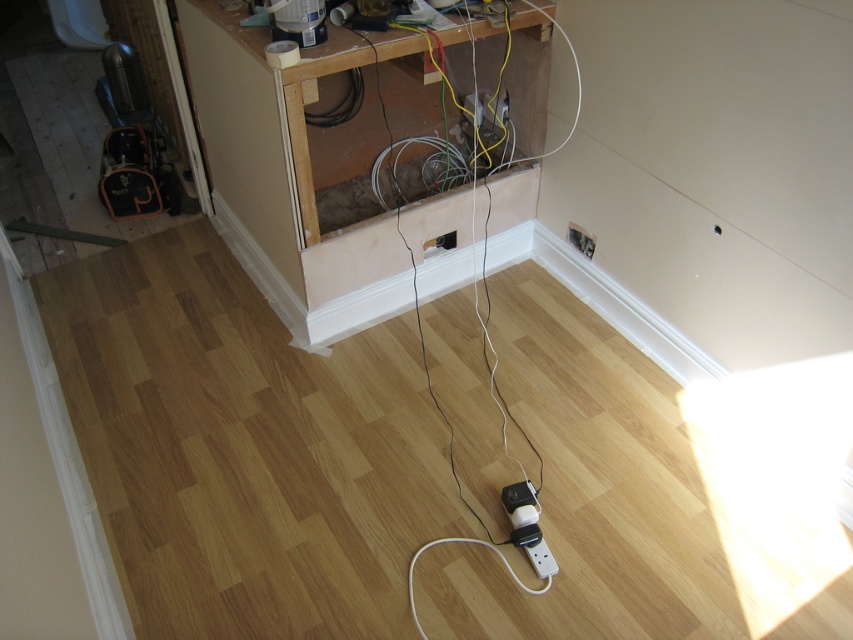
Is white plastic electric outlet at lower right thinner than white plastic electric outlet at center?

Indeed, white plastic electric outlet at lower right has a lesser width compared to white plastic electric outlet at center.

Which is in front, point (576, 241) or point (430, 243)?

Positioned in front is point (430, 243).

Is point (585, 237) in front of point (440, 236)?

No, (585, 237) is further to viewer.

Identify the location of white plastic electric outlet at lower right. The height and width of the screenshot is (640, 853). tap(579, 240).